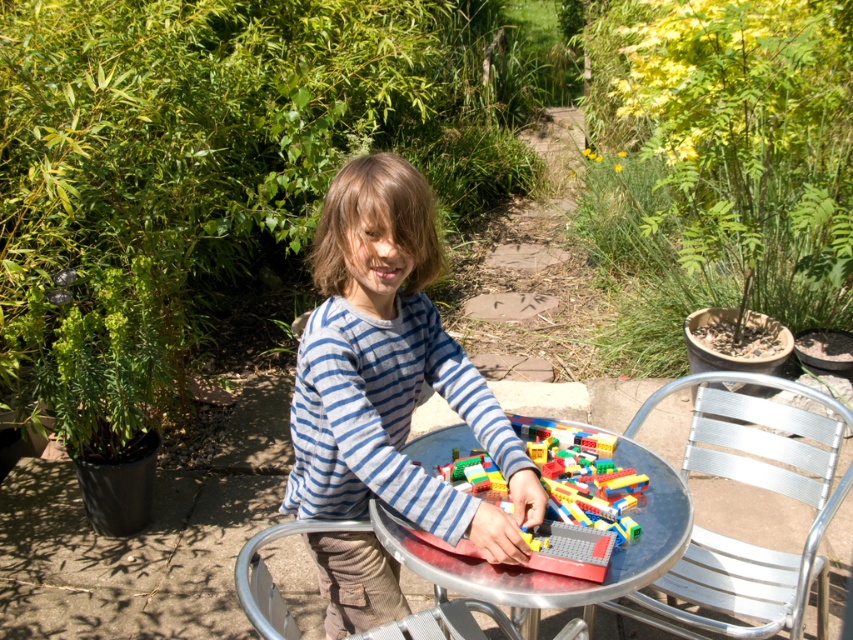
Describe the element at coordinates (560, 573) in the screenshot. I see `metallic silver table at center` at that location.

Is metallic silver table at center to the left of metallic silver chair at lower center from the viewer's perspective?

In fact, metallic silver table at center is to the right of metallic silver chair at lower center.

Between point (498, 595) and point (245, 602), which one is positioned in front?

Point (245, 602) is more forward.

Where is `metallic silver table at center`? The width and height of the screenshot is (853, 640). metallic silver table at center is located at coordinates (560, 573).

Is green leafy plant at upper right thinner than metallic silver chair at lower center?

No.

Is point (815, 312) behind point (346, 525)?

Yes.

Does point (703, 100) lie in front of point (234, 566)?

No, (703, 100) is further to viewer.

Locate an element on the screen. green leafy plant at upper right is located at coordinates (720, 164).

Is green leafy plant at upper right to the left of blue striped shirt at center from the viewer's perspective?

In fact, green leafy plant at upper right is to the right of blue striped shirt at center.

Based on the photo, can you confirm if green leafy plant at upper right is taller than blue striped shirt at center?

Yes, green leafy plant at upper right is taller than blue striped shirt at center.

Between point (631, 99) and point (398, 166), which one is positioned in front?

Point (398, 166) is more forward.

Locate an element on the screen. green leafy plant at upper right is located at coordinates (720, 164).